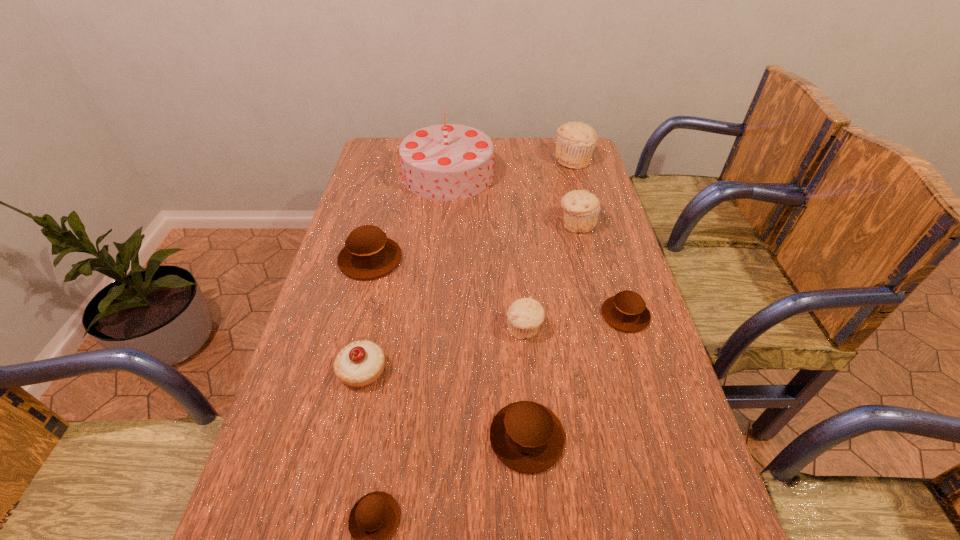
Where is `the second closest object to the fifth nearest muffin`? The image size is (960, 540). the second closest object to the fifth nearest muffin is located at coordinates 359,364.

The image size is (960, 540). I want to click on object that stands as the eighth closest to the farthest muffin, so click(x=374, y=518).

Identify which muffin is the nearest to the biggest brown muffin. Please provide its 2D coordinates. Your answer should be formatted as a tuple, i.e. [(x, y)], where the tuple contains the x and y coordinates of a point satisfying the conditions above.

[(525, 315)]

Locate which muffin ranks in proximity to the nearest beige muffin. Please provide its 2D coordinates. Your answer should be formatted as a tuple, i.e. [(x, y)], where the tuple contains the x and y coordinates of a point satisfying the conditions above.

[(626, 311)]

Identify which beige muffin is the third nearest to the tallest object. Please provide its 2D coordinates. Your answer should be formatted as a tuple, i.e. [(x, y)], where the tuple contains the x and y coordinates of a point satisfying the conditions above.

[(525, 315)]

Point out which beige muffin is positioned as the third nearest to the second farthest brown muffin. Please provide its 2D coordinates. Your answer should be formatted as a tuple, i.e. [(x, y)], where the tuple contains the x and y coordinates of a point satisfying the conditions above.

[(576, 141)]

Locate which brown muffin ranks in proximity to the tallest muffin. Please provide its 2D coordinates. Your answer should be formatted as a tuple, i.e. [(x, y)], where the tuple contains the x and y coordinates of a point satisfying the conditions above.

[(626, 311)]

The image size is (960, 540). What are the coordinates of `brown muffin identified as the third closest to the leftmost beige muffin` in the screenshot? It's located at (368, 254).

Find the location of a particular element. Image resolution: width=960 pixels, height=540 pixels. vacant space that satisfies the following two spatial constraints: 1. on the back side of the second farthest brown muffin; 2. on the left side of the seventh farthest object is located at coordinates (374, 315).

This screenshot has height=540, width=960. I want to click on free space that satisfies the following two spatial constraints: 1. on the front side of the seventh farthest object; 2. on the right side of the fifth nearest muffin, so 342,371.